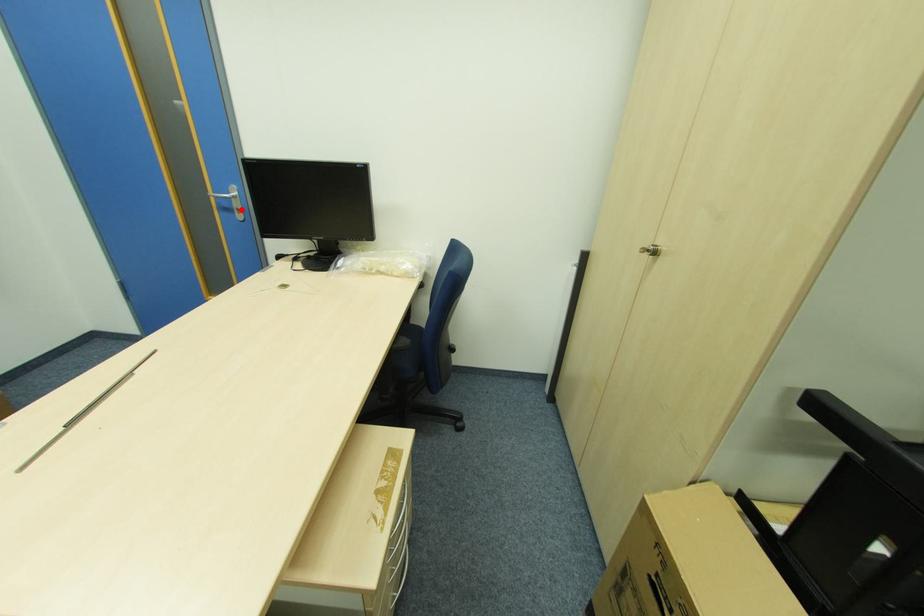
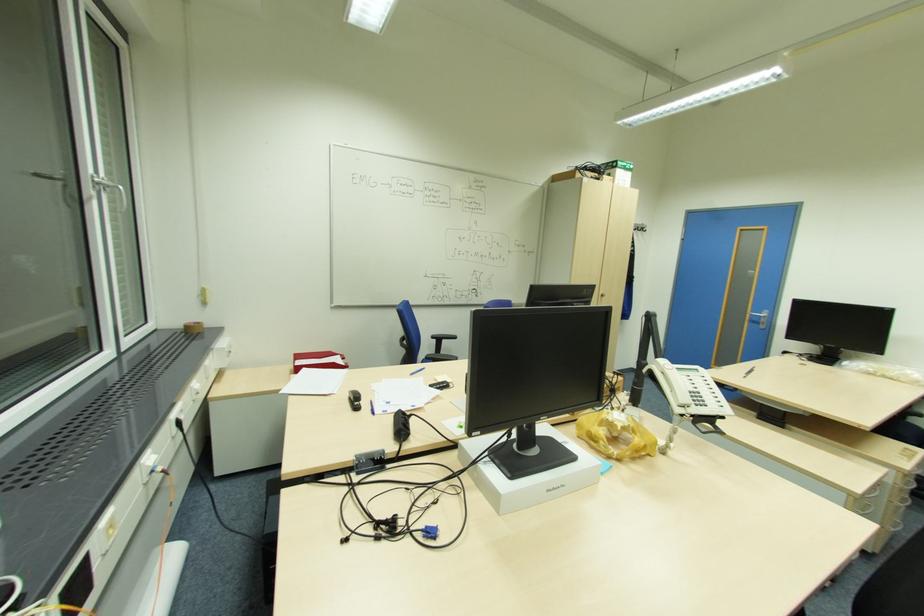
In the second image, find the point that corresponds to the highlighted location in the first image.

(766, 323)